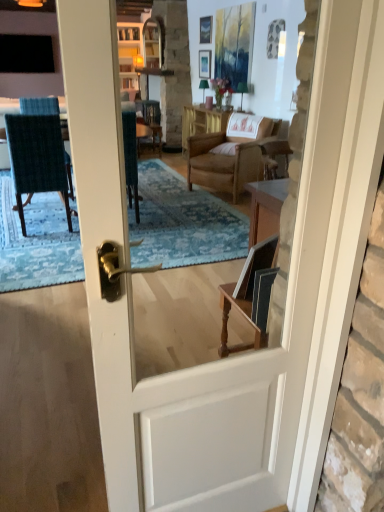
Image resolution: width=384 pixels, height=512 pixels. What do you see at coordinates (206, 29) in the screenshot?
I see `wooden picture frame at upper center, the 2th picture frame positioned from the bottom` at bounding box center [206, 29].

Measure the distance between black glass window at upper left and camera.

black glass window at upper left and camera are 5.20 meters apart.

Describe the element at coordinates (37, 158) in the screenshot. The image size is (384, 512). I see `dark blue textured fabric chair at left` at that location.

At what (x,y) coordinates should I click in order to perform the action: click on wooden picture frame at upper center, the first picture frame in the top-to-bottom sequence. Please return your answer as a coordinate pair (x, y). The image size is (384, 512). Looking at the image, I should click on (206, 29).

Based on the photo, which object is positioned more to the left, black glass window at upper left or wooden table at center?

Positioned to the left is black glass window at upper left.

From the image's perspective, which is above, black glass window at upper left or wooden table at center?

black glass window at upper left.

Which is correct: black glass window at upper left is inside wooden table at center, or outside of it?

black glass window at upper left exists outside the volume of wooden table at center.

Starting from the dark blue textured fabric chair at left, which picture frame is the 2nd one to the right? Please provide its 2D coordinates.

[(206, 29)]

Can you confirm if dark blue textured fabric chair at left is thinner than wooden picture frame at upper center, the 2th picture frame positioned from the bottom?

Incorrect, the width of dark blue textured fabric chair at left is not less than that of wooden picture frame at upper center, the 2th picture frame positioned from the bottom.

Who is smaller, dark blue textured fabric chair at left or wooden picture frame at upper center, the 2th picture frame positioned from the bottom?

wooden picture frame at upper center, the 2th picture frame positioned from the bottom, is smaller.

Which is behind, dark blue textured fabric chair at left or wooden picture frame at upper center, the 2th picture frame positioned from the bottom?

wooden picture frame at upper center, the 2th picture frame positioned from the bottom, is further away from the camera.

Which of these two, wooden table at center or dark blue textured fabric chair at left, stands taller?

dark blue textured fabric chair at left is taller.

Measure the distance from wooden table at center to dark blue textured fabric chair at left.

They are 2.45 meters apart.

Considering the sizes of objects wooden table at center and dark blue textured fabric chair at left in the image provided, who is wider, wooden table at center or dark blue textured fabric chair at left?

With larger width is dark blue textured fabric chair at left.

From a real-world perspective, is wooden table at center above or below dark blue textured fabric chair at left?

wooden table at center is situated lower than dark blue textured fabric chair at left in the real world.

Is wooden table at center inside the boundaries of matte white picture frame at upper center, the 1th picture frame ordered from the bottom, or outside?

wooden table at center is spatially situated outside matte white picture frame at upper center, the 1th picture frame ordered from the bottom.

What's the angular difference between wooden table at center and matte white picture frame at upper center, the 1th picture frame ordered from the bottom,'s facing directions?

The angular difference between wooden table at center and matte white picture frame at upper center, the 1th picture frame ordered from the bottom, is 0.832 degrees.

Considering the positions of objects wooden table at center and matte white picture frame at upper center, the second picture frame in the top-to-bottom sequence, in the image provided, who is more to the left, wooden table at center or matte white picture frame at upper center, the second picture frame in the top-to-bottom sequence,?

Positioned to the left is matte white picture frame at upper center, the second picture frame in the top-to-bottom sequence.

From a real-world perspective, is wooden table at center positioned above or below matte white picture frame at upper center, the 1th picture frame ordered from the bottom?

wooden table at center is below matte white picture frame at upper center, the 1th picture frame ordered from the bottom.

Considering the relative sizes of dark blue textured fabric chair at left and matte white picture frame at upper center, the 1th picture frame ordered from the bottom, in the image provided, is dark blue textured fabric chair at left shorter than matte white picture frame at upper center, the 1th picture frame ordered from the bottom,?

No, dark blue textured fabric chair at left is not shorter than matte white picture frame at upper center, the 1th picture frame ordered from the bottom.

Is dark blue textured fabric chair at left to the left of matte white picture frame at upper center, the 1th picture frame ordered from the bottom, from the viewer's perspective?

Correct, you'll find dark blue textured fabric chair at left to the left of matte white picture frame at upper center, the 1th picture frame ordered from the bottom.

Who is smaller, dark blue textured fabric chair at left or matte white picture frame at upper center, the second picture frame in the top-to-bottom sequence?

matte white picture frame at upper center, the second picture frame in the top-to-bottom sequence, is smaller.

Considering the sizes of wooden picture frame at upper center, the first picture frame in the top-to-bottom sequence, and matte white picture frame at upper center, the 1th picture frame ordered from the bottom, in the image, is wooden picture frame at upper center, the first picture frame in the top-to-bottom sequence, taller or shorter than matte white picture frame at upper center, the 1th picture frame ordered from the bottom,?

Considering their sizes, wooden picture frame at upper center, the first picture frame in the top-to-bottom sequence, has less height than matte white picture frame at upper center, the 1th picture frame ordered from the bottom.

Is wooden picture frame at upper center, the first picture frame in the top-to-bottom sequence, directly adjacent to matte white picture frame at upper center, the 1th picture frame ordered from the bottom?

wooden picture frame at upper center, the first picture frame in the top-to-bottom sequence, is not next to matte white picture frame at upper center, the 1th picture frame ordered from the bottom, and they're not touching.

Is wooden picture frame at upper center, the 2th picture frame positioned from the bottom, positioned with its back to matte white picture frame at upper center, the second picture frame in the top-to-bottom sequence?

wooden picture frame at upper center, the 2th picture frame positioned from the bottom, does not have its back to matte white picture frame at upper center, the second picture frame in the top-to-bottom sequence.

Which object is wider, wooden picture frame at upper center, the 2th picture frame positioned from the bottom, or matte white picture frame at upper center, the 1th picture frame ordered from the bottom?

With larger width is matte white picture frame at upper center, the 1th picture frame ordered from the bottom.

From a real-world perspective, is wooden table at center over wooden picture frame at upper center, the 2th picture frame positioned from the bottom?

Actually, wooden table at center is physically below wooden picture frame at upper center, the 2th picture frame positioned from the bottom, in the real world.

Is wooden table at center closer to camera compared to wooden picture frame at upper center, the 2th picture frame positioned from the bottom?

Yes, wooden table at center is closer to the viewer.

What are the coordinates of `table that appears in front of the black glass window at upper left` in the screenshot? It's located at point(202,121).

You are a GUI agent. You are given a task and a screenshot of the screen. Output one action in this format:
    pyautogui.click(x=<x>, y=<y>)
    Task: Click on the 2nd picture frame directly above the dark blue textured fabric chair at left (from a real-world perspective)
    This screenshot has height=512, width=384.
    Given the screenshot: What is the action you would take?
    pyautogui.click(x=206, y=29)

Based on their spatial positions, is matte white picture frame at upper center, the 1th picture frame ordered from the bottom, or wooden table at center further from black glass window at upper left?

matte white picture frame at upper center, the 1th picture frame ordered from the bottom, lies further to black glass window at upper left than the other object.

Considering their positions, is wooden picture frame at upper center, the 2th picture frame positioned from the bottom, positioned closer to wooden table at center than black glass window at upper left?

Among the two, wooden picture frame at upper center, the 2th picture frame positioned from the bottom, is located nearer to wooden table at center.

In the scene shown: When comparing their distances from dark blue textured fabric chair at left, does black glass window at upper left or wooden table at center seem further?

black glass window at upper left.

Which object lies further to the anchor point wooden table at center, dark blue textured fabric chair at left or wooden picture frame at upper center, the first picture frame in the top-to-bottom sequence?

The object further to wooden table at center is dark blue textured fabric chair at left.

Looking at the image, which one is located closer to dark blue textured fabric chair at left, wooden table at center or black glass window at upper left?

The object closer to dark blue textured fabric chair at left is wooden table at center.

From the image, which object appears to be farther from black glass window at upper left, dark blue textured fabric chair at left or matte white picture frame at upper center, the second picture frame in the top-to-bottom sequence?

The object further to black glass window at upper left is dark blue textured fabric chair at left.

From the image, which object appears to be nearer to dark blue textured fabric chair at left, wooden picture frame at upper center, the 2th picture frame positioned from the bottom, or wooden table at center?

The object closer to dark blue textured fabric chair at left is wooden table at center.

When comparing their distances from wooden picture frame at upper center, the 2th picture frame positioned from the bottom, does black glass window at upper left or wooden table at center seem closer?

wooden table at center lies closer to wooden picture frame at upper center, the 2th picture frame positioned from the bottom, than the other object.

This screenshot has width=384, height=512. Identify the location of table between dark blue textured fabric chair at left and matte white picture frame at upper center, the second picture frame in the top-to-bottom sequence, in the front-back direction. (202, 121).

The height and width of the screenshot is (512, 384). Find the location of `picture frame between wooden picture frame at upper center, the 2th picture frame positioned from the bottom, and wooden table at center from top to bottom`. picture frame between wooden picture frame at upper center, the 2th picture frame positioned from the bottom, and wooden table at center from top to bottom is located at coordinates [x=205, y=64].

Locate an element on the screen. The height and width of the screenshot is (512, 384). picture frame between black glass window at upper left and wooden picture frame at upper center, the first picture frame in the top-to-bottom sequence is located at coordinates (205, 64).

Image resolution: width=384 pixels, height=512 pixels. Find the location of `picture frame between dark blue textured fabric chair at left and matte white picture frame at upper center, the second picture frame in the top-to-bottom sequence, from front to back`. picture frame between dark blue textured fabric chair at left and matte white picture frame at upper center, the second picture frame in the top-to-bottom sequence, from front to back is located at coordinates (206, 29).